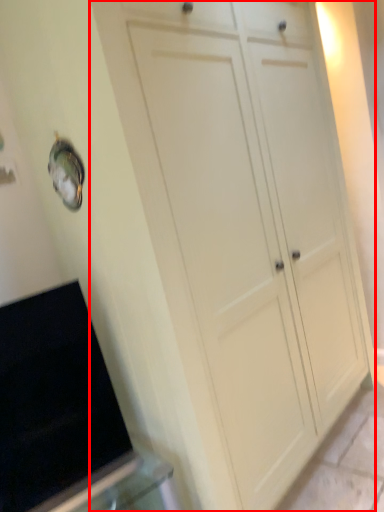
Question: Observing the image, what is the correct spatial positioning of cupboard (annotated by the red box) in reference to appliance?

Choices:
 (A) left
 (B) right

Answer: (B)